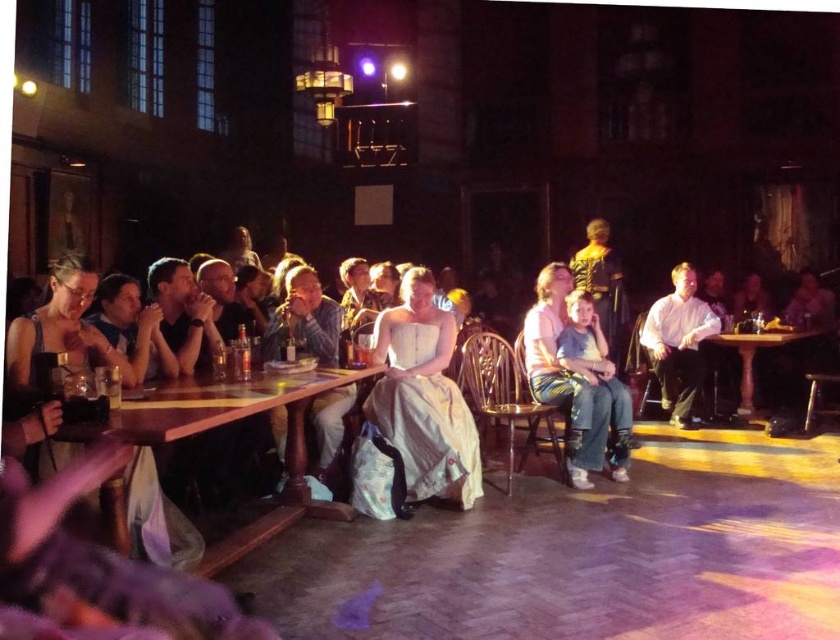
Question: Which object appears closest to the camera in this image?

Choices:
 (A) translucent glass bottle at center
 (B) white cotton shirt at center
 (C) wooden table at right

Answer: (A)

Question: Considering the real-world distances, which object is closest to the light blue jeans at center?

Choices:
 (A) denim jacket at center
 (B) wooden table at lower left
 (C) wooden table at right

Answer: (A)

Question: Observing the image, what is the correct spatial positioning of light blue jeans at center in reference to translucent glass bottle at center?

Choices:
 (A) left
 (B) right

Answer: (B)

Question: Does wooden table at lower left appear under light blue jeans at center?

Choices:
 (A) yes
 (B) no

Answer: (A)

Question: Which point is farther from the camera taking this photo?

Choices:
 (A) (303, 492)
 (B) (597, 348)
 (C) (672, 413)

Answer: (C)

Question: Is white cotton shirt at center closer to camera compared to light blue jeans at center?

Choices:
 (A) yes
 (B) no

Answer: (B)